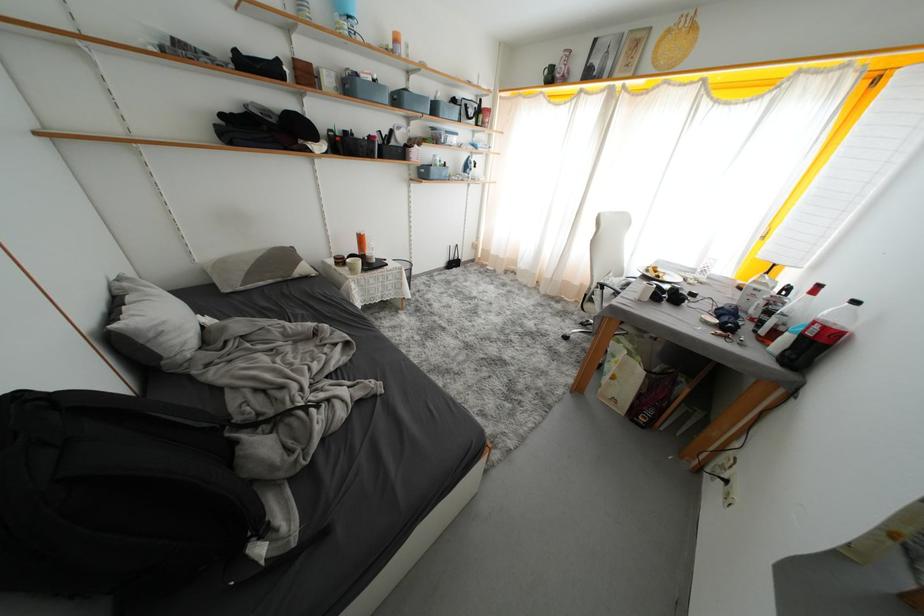
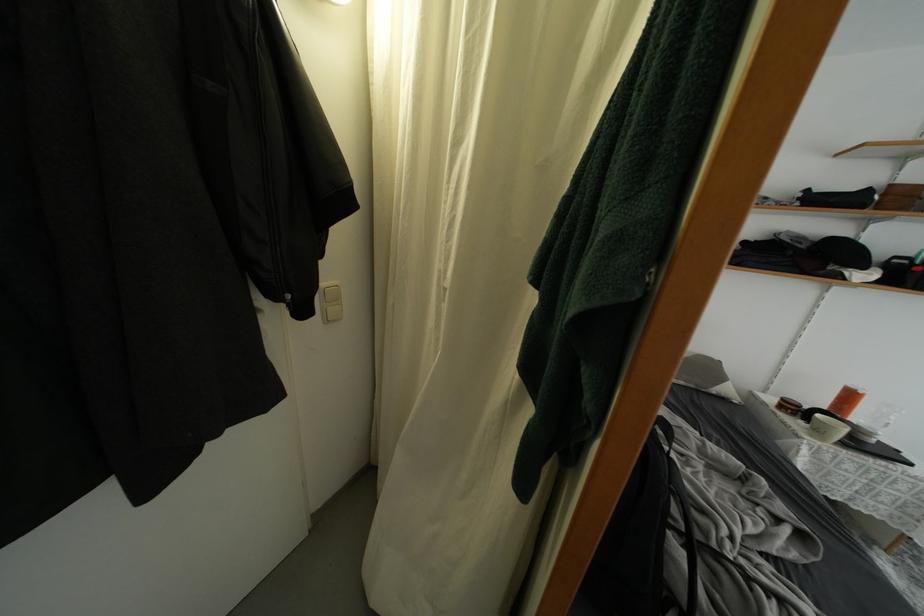
The point at (333,330) is marked in the first image. Where is the corresponding point in the second image?

(769, 485)